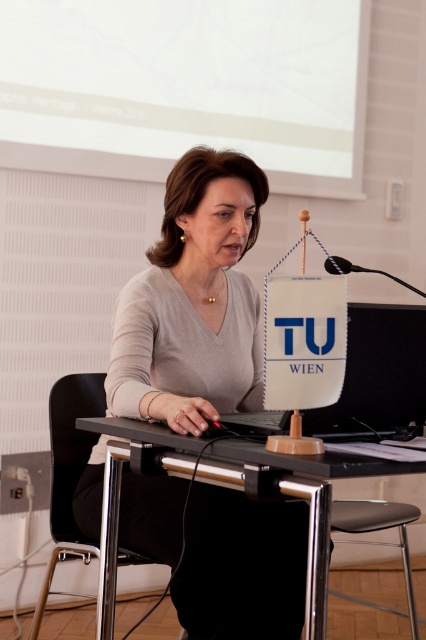
You are standing in the conference room and need to locate the white matte projection screen at upper center. According to the coordinates provided, where exactly is it positioned?

The white matte projection screen at upper center is positioned at coordinates point (187, 86).

You are a person who is 6 feet tall. You are standing in front of the black plastic table at center and the black plastic chair at center. If you want to sit on the chair, will you have enough space to move between the table and the chair?

The distance between the black plastic table at center and the black plastic chair at center is 16.99 inches. Since an average person requires about 20 inches of space to sit comfortably, the distance is insufficient. Therefore, you may not have enough space to move between them comfortably.

You are a delivery person who needs to place a small package between the matte gray sweater at center and the black plastic chair at center on the desk. Can you fit the package there if it measures 12 inches in length?

The distance between the matte gray sweater at center and the black plastic chair at center is 14.49 inches. Since the package is only 12 inches long, it should fit comfortably within the space available.